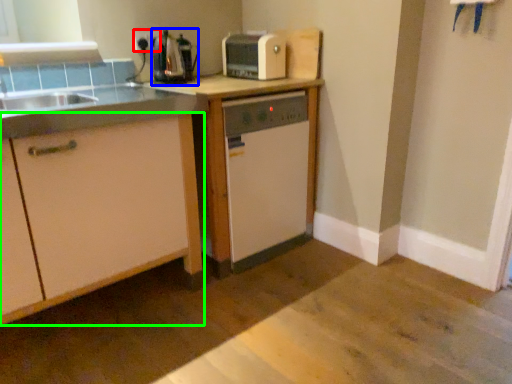
Question: Which object is the farthest from electric outlet (highlighted by a red box)? Choose among these: coffee machine (highlighted by a blue box) or cabinetry (highlighted by a green box).

Choices:
 (A) coffee machine
 (B) cabinetry

Answer: (B)